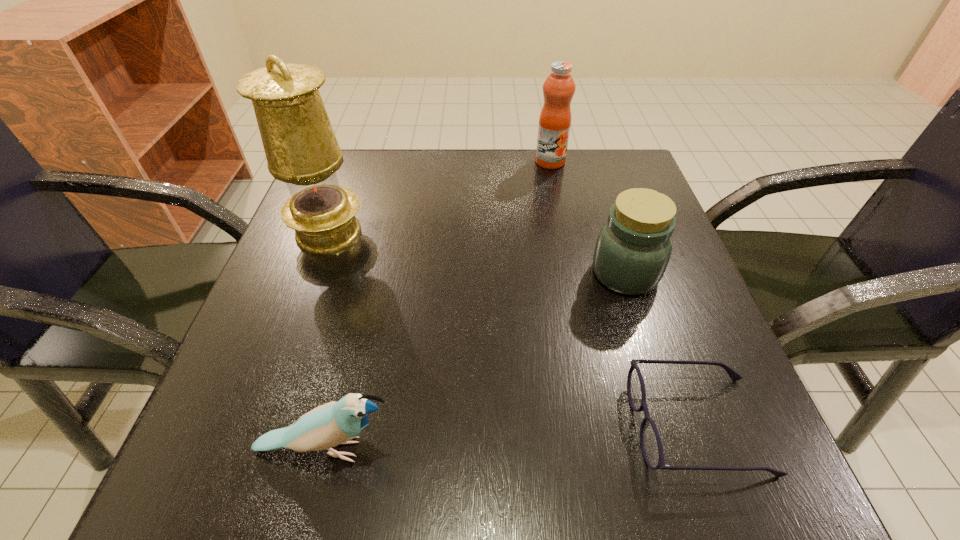
Where is `vacant space located 0.370m on the front-facing side of the spectacles`? The image size is (960, 540). vacant space located 0.370m on the front-facing side of the spectacles is located at coordinates (364, 426).

This screenshot has width=960, height=540. What are the coordinates of `free space located 0.110m on the front-facing side of the spectacles` in the screenshot? It's located at (554, 426).

Identify the location of free space located 0.280m on the front-facing side of the spectacles. (429, 426).

Identify the location of object present at the far edge. The height and width of the screenshot is (540, 960). (559, 87).

Where is `bird that is positioned at the near edge`? Image resolution: width=960 pixels, height=540 pixels. bird that is positioned at the near edge is located at coordinates (334, 423).

The width and height of the screenshot is (960, 540). I want to click on spectacles that is positioned at the near edge, so click(651, 446).

You are a GUI agent. You are given a task and a screenshot of the screen. Output one action in this format:
    pyautogui.click(x=<x>, y=<y>)
    Task: Click on the oil lamp that is at the left edge
    The height and width of the screenshot is (540, 960).
    Given the screenshot: What is the action you would take?
    pyautogui.click(x=301, y=149)

Where is `bird situated at the left edge`? bird situated at the left edge is located at coordinates (334, 423).

Where is `jar positioned at the right edge`? The height and width of the screenshot is (540, 960). jar positioned at the right edge is located at coordinates (633, 248).

Locate an element on the screen. spectacles situated at the right edge is located at coordinates click(x=651, y=446).